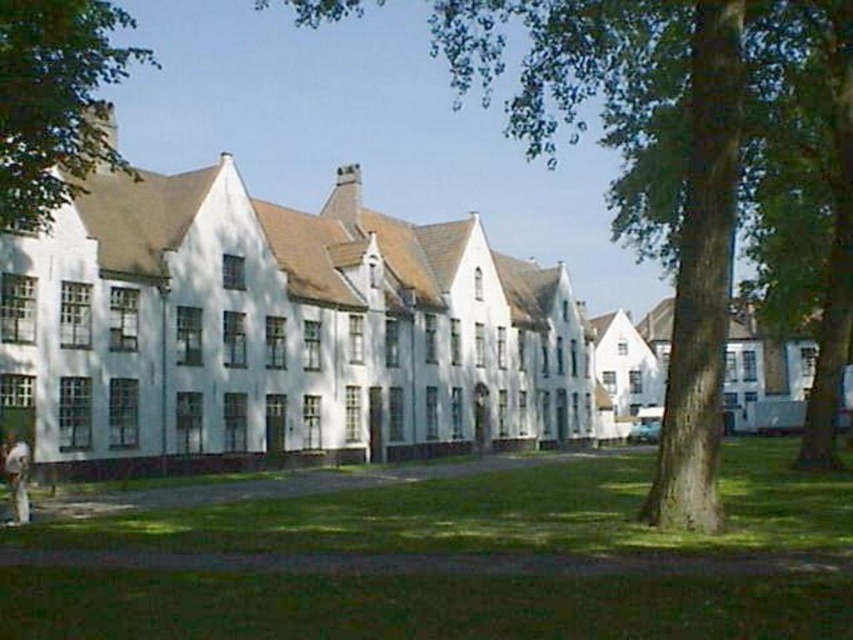
Is green textured tree at center shorter than light brown leather jacket at lower left?

Incorrect, green textured tree at center's height does not fall short of light brown leather jacket at lower left's.

Which is more to the left, green textured tree at center or light brown leather jacket at lower left?

A: Positioned to the left is light brown leather jacket at lower left.

Measure the distance between point [820,291] and camera.

A distance of 192.02 feet exists between point [820,291] and camera.

Find the location of `green textured tree at center`. green textured tree at center is located at coordinates tap(695, 173).

Between point (410, 483) and point (45, 81), which one is positioned in front?

Positioned in front is point (45, 81).

Is green grass at lower center to the left of green leafy tree at upper left from the viewer's perspective?

In fact, green grass at lower center is to the right of green leafy tree at upper left.

Which is in front, point (747, 580) or point (57, 154)?

Point (747, 580)

Find the location of a particular element. This screenshot has height=640, width=853. green grass at lower center is located at coordinates (451, 561).

Looking at this image, how far apart are green grass at lower center and light brown leather jacket at lower left?

green grass at lower center is 11.83 meters from light brown leather jacket at lower left.

Between green grass at lower center and light brown leather jacket at lower left, which one appears on the left side from the viewer's perspective?

Positioned to the left is light brown leather jacket at lower left.

The height and width of the screenshot is (640, 853). Identify the location of green grass at lower center. (451, 561).